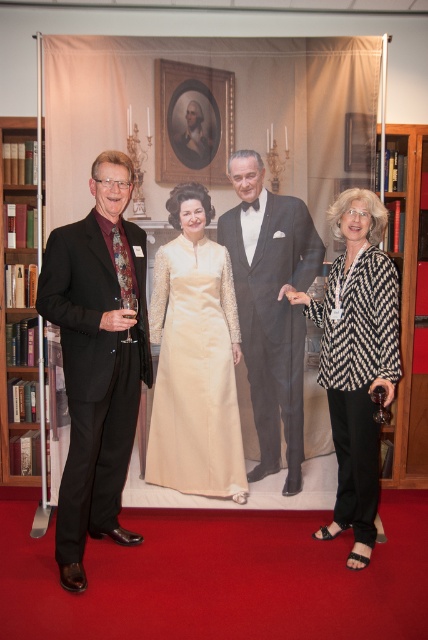
Question: Does patterned fabric blouse at right appear on the right side of shiny black tuxedo at center?

Choices:
 (A) no
 (B) yes

Answer: (B)

Question: Estimate the real-world distances between objects in this image. Which object is farther from the shiny black tuxedo at center?

Choices:
 (A) wooden bookshelf at right
 (B) ivory satin gown at center
 (C) patterned fabric blouse at right

Answer: (A)

Question: Can you confirm if matte black suit at left is positioned below patterned fabric blouse at right?

Choices:
 (A) no
 (B) yes

Answer: (A)

Question: Is matte black suit at left in front of patterned fabric blouse at right?

Choices:
 (A) no
 (B) yes

Answer: (B)

Question: Estimate the real-world distances between objects in this image. Which object is closer to the matte black suit at left?

Choices:
 (A) patterned fabric blouse at right
 (B) brown wooden bookshelf at left
 (C) wooden bookshelf at right
 (D) shiny black tuxedo at center

Answer: (D)

Question: Estimate the real-world distances between objects in this image. Which object is farther from the brown wooden bookshelf at left?

Choices:
 (A) matte black suit at left
 (B) wooden bookshelf at right
 (C) patterned fabric blouse at right

Answer: (B)